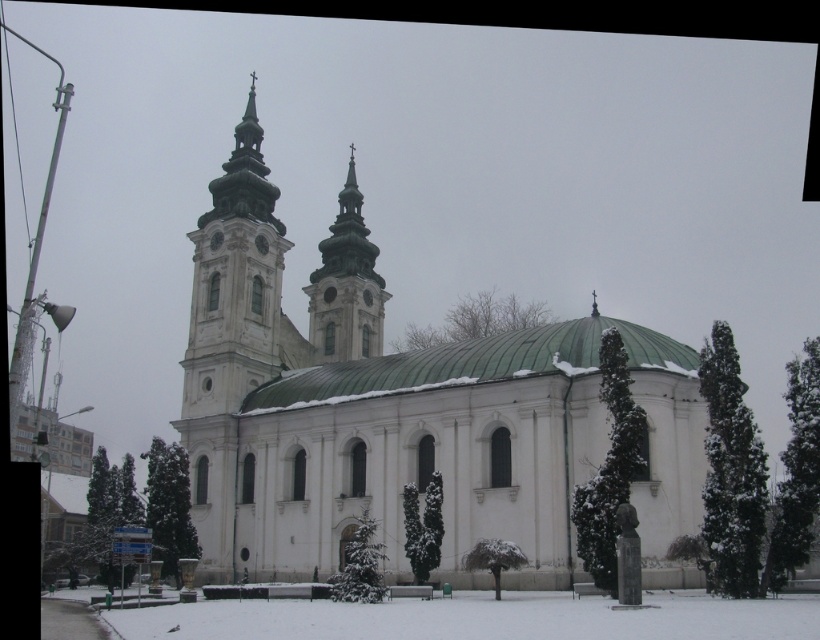
Question: Considering the relative positions of white stone tower at upper left and smooth white steeple at center in the image provided, where is white stone tower at upper left located with respect to smooth white steeple at center?

Choices:
 (A) above
 (B) below

Answer: (B)

Question: Is white stone church at center to the left of white stone tower at upper left from the viewer's perspective?

Choices:
 (A) yes
 (B) no

Answer: (B)

Question: Where is white stone church at center located in relation to smooth white steeple at center in the image?

Choices:
 (A) above
 (B) below

Answer: (B)

Question: Which point is closer to the camera?

Choices:
 (A) (240, 120)
 (B) (344, 346)

Answer: (A)

Question: Which object appears farthest from the camera in this image?

Choices:
 (A) white stone tower at upper left
 (B) white stone church at center
 (C) smooth white steeple at center

Answer: (C)

Question: Which of the following is the farthest from the observer?

Choices:
 (A) [x=328, y=291]
 (B) [x=287, y=244]

Answer: (A)